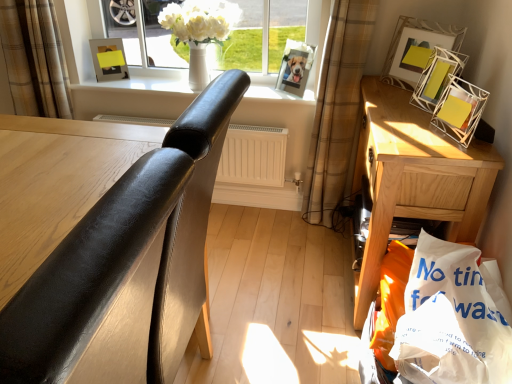
What is the approximate width of white smooth window sill at upper center?

white smooth window sill at upper center is 9.03 inches in width.

What do you see at coordinates (34, 58) in the screenshot? Image resolution: width=512 pixels, height=384 pixels. I see `plaid fabric curtain at upper left, which appears as the 1th curtain when viewed from the left` at bounding box center [34, 58].

Describe the element at coordinates (109, 59) in the screenshot. I see `yellow matte picture frame at upper left, acting as the 4th picture frame starting from the right` at that location.

At what (x,y) coordinates should I click in order to perform the action: click on white paper shopping bag at lower right. Please return your answer as a coordinate pair (x, y). The height and width of the screenshot is (384, 512). Looking at the image, I should click on (453, 318).

Is metallic silver picture frame at upper right, positioned as the second picture frame in right-to-left order, positioned far away from plaid fabric curtain at upper left, the second curtain in the right-to-left sequence?

Absolutely, metallic silver picture frame at upper right, positioned as the second picture frame in right-to-left order, is distant from plaid fabric curtain at upper left, the second curtain in the right-to-left sequence.

Can you confirm if metallic silver picture frame at upper right, positioned as the second picture frame in right-to-left order, is positioned to the left of plaid fabric curtain at upper left, which appears as the 1th curtain when viewed from the left?

No.

Is metallic silver picture frame at upper right, positioned as the second picture frame in right-to-left order, wider or thinner than plaid fabric curtain at upper left, which appears as the 1th curtain when viewed from the left?

Considering their sizes, metallic silver picture frame at upper right, positioned as the second picture frame in right-to-left order, looks slimmer than plaid fabric curtain at upper left, which appears as the 1th curtain when viewed from the left.

Is metallic silver picture frame at upper right, positioned as the second picture frame in right-to-left order, taller or shorter than plaid fabric curtain at upper left, the second curtain in the right-to-left sequence?

metallic silver picture frame at upper right, positioned as the second picture frame in right-to-left order, is shorter than plaid fabric curtain at upper left, the second curtain in the right-to-left sequence.

From a real-world perspective, between white wire mesh picture frame at upper right, acting as the first picture frame starting from the right, and plaid fabric curtain at upper left, which appears as the 1th curtain when viewed from the left, who is vertically higher?

In real-world perspective, white wire mesh picture frame at upper right, acting as the first picture frame starting from the right, is above.

Does point (422, 73) come farther from viewer compared to point (53, 45)?

No, (422, 73) is closer to viewer.

Which is more to the left, white wire mesh picture frame at upper right, acting as the first picture frame starting from the right, or plaid fabric curtain at upper left, which appears as the 1th curtain when viewed from the left?

plaid fabric curtain at upper left, which appears as the 1th curtain when viewed from the left.

Is white wire mesh picture frame at upper right, acting as the first picture frame starting from the right, behind plaid fabric curtain at upper left, the second curtain in the right-to-left sequence?

No.

Considering the relative sizes of black leather chair at left and white matte vase at upper center in the image provided, is black leather chair at left smaller than white matte vase at upper center?

Incorrect, black leather chair at left is not smaller in size than white matte vase at upper center.

Locate an element on the screen. The image size is (512, 384). floral arrangement that appears above the black leather chair at left (from a real-world perspective) is located at coordinates (199, 31).

Is point (51, 254) positioned in front of point (174, 9)?

Yes, it is.

From the picture: Considering the relative positions of black leather chair at left and white matte vase at upper center in the image provided, is black leather chair at left behind white matte vase at upper center?

No, black leather chair at left is closer to the viewer.

Is yellow matte picture frame at upper left, acting as the 4th picture frame starting from the right, not within white matte vase at upper center?

Yes, yellow matte picture frame at upper left, acting as the 4th picture frame starting from the right, is not within white matte vase at upper center.

From a real-world perspective, is yellow matte picture frame at upper left, acting as the 4th picture frame starting from the right, positioned above or below white matte vase at upper center?

In terms of real-world spatial position, yellow matte picture frame at upper left, acting as the 4th picture frame starting from the right, is below white matte vase at upper center.

Between yellow matte picture frame at upper left, the first picture frame positioned from the left, and white matte vase at upper center, which one has more height?

white matte vase at upper center.

From the image's perspective, which one is positioned higher, black leather chair at left or white wire mesh picture frame at upper right, positioned as the 4th picture frame in left-to-right order?

white wire mesh picture frame at upper right, positioned as the 4th picture frame in left-to-right order.

From a real-world perspective, is black leather chair at left positioned above or below white wire mesh picture frame at upper right, acting as the first picture frame starting from the right?

black leather chair at left is below white wire mesh picture frame at upper right, acting as the first picture frame starting from the right.

In terms of height, does black leather chair at left look taller or shorter compared to white wire mesh picture frame at upper right, acting as the first picture frame starting from the right?

Clearly, black leather chair at left is taller compared to white wire mesh picture frame at upper right, acting as the first picture frame starting from the right.

Which is correct: black leather chair at left is inside white wire mesh picture frame at upper right, positioned as the 4th picture frame in left-to-right order, or outside of it?

Result: black leather chair at left exists outside the volume of white wire mesh picture frame at upper right, positioned as the 4th picture frame in left-to-right order.

Which of these two, black leather chair at left or metallic silver picture frame at upper right, which is counted as the 3th picture frame, starting from the left, stands taller?

black leather chair at left is taller.

Which of these two, black leather chair at left or metallic silver picture frame at upper right, positioned as the second picture frame in right-to-left order, is wider?

With larger width is black leather chair at left.

From a real-world perspective, is black leather chair at left positioned above or below metallic silver picture frame at upper right, which is counted as the 3th picture frame, starting from the left?

In terms of real-world spatial position, black leather chair at left is below metallic silver picture frame at upper right, which is counted as the 3th picture frame, starting from the left.

From the image's perspective, is black leather chair at left located above or below metallic silver picture frame at upper right, positioned as the second picture frame in right-to-left order?

From the image's perspective, black leather chair at left appears below metallic silver picture frame at upper right, positioned as the second picture frame in right-to-left order.

Where is `window on the right of white smooth window sill at upper center`? Image resolution: width=512 pixels, height=384 pixels. window on the right of white smooth window sill at upper center is located at coordinates 79,35.

Is white smooth window sill at upper center next to white glossy vase at upper center and touching it?

No, white smooth window sill at upper center is not beside white glossy vase at upper center.

From the picture: From a real-world perspective, between white smooth window sill at upper center and white glossy vase at upper center, who is vertically lower?

From a 3D spatial view, white smooth window sill at upper center is below.

Is white smooth window sill at upper center closer to camera compared to white glossy vase at upper center?

No, it is not.

From the plaid fabric curtain at upper left, the second curtain in the right-to-left sequence, count 3rd picture frame to the right and point to it. Please provide its 2D coordinates.

[(415, 48)]

The height and width of the screenshot is (384, 512). In order to click on the 2nd picture frame directly above the plaid fabric curtain at upper left, the second curtain in the right-to-left sequence (from a real-world perspective) in this screenshot , I will do `click(436, 77)`.

Considering their positions, is plaid fabric curtain at upper left, the second curtain in the right-to-left sequence, positioned closer to yellow matte picture frame at upper left, the first picture frame positioned from the left, than white smooth window sill at upper center?

white smooth window sill at upper center lies closer to yellow matte picture frame at upper left, the first picture frame positioned from the left, than the other object.

Based on their spatial positions, is black leather chair at left or white smooth window sill at upper center further from plaid fabric curtain at center, placed as the 1th curtain when sorted from right to left?

black leather chair at left lies further to plaid fabric curtain at center, placed as the 1th curtain when sorted from right to left, than the other object.

Which object lies nearer to the anchor point plaid fabric curtain at upper left, the second curtain in the right-to-left sequence, yellow matte picture frame at upper left, acting as the 4th picture frame starting from the right, or white matte vase at upper center?

yellow matte picture frame at upper left, acting as the 4th picture frame starting from the right, is closer to plaid fabric curtain at upper left, the second curtain in the right-to-left sequence.

Considering their positions, is white matte vase at upper center positioned closer to plaid fabric curtain at upper left, which appears as the 1th curtain when viewed from the left, than black leather chair at left?

The object closer to plaid fabric curtain at upper left, which appears as the 1th curtain when viewed from the left, is white matte vase at upper center.

From the image, which object appears to be farther from white smooth window sill at upper center, white matte vase at upper center or metallic silver picture frame at upper right, positioned as the second picture frame in right-to-left order?

metallic silver picture frame at upper right, positioned as the second picture frame in right-to-left order, is positioned further to the anchor white smooth window sill at upper center.

When comparing their distances from white smooth window sill at upper center, does white paper shopping bag at lower right or plaid fabric curtain at upper left, which appears as the 1th curtain when viewed from the left, seem further?

white paper shopping bag at lower right is positioned further to the anchor white smooth window sill at upper center.

Looking at the image, which one is located further to plaid fabric curtain at upper left, which appears as the 1th curtain when viewed from the left, metallic silver photo frame at upper center, the 3th picture frame viewed from the right, or yellow matte picture frame at upper left, the first picture frame positioned from the left?

Based on the image, metallic silver photo frame at upper center, the 3th picture frame viewed from the right, appears to be further to plaid fabric curtain at upper left, which appears as the 1th curtain when viewed from the left.

From the image, which object appears to be farther from white smooth window sill at upper center, wooden nightstand at right or white matte vase at upper center?

The object further to white smooth window sill at upper center is wooden nightstand at right.

The height and width of the screenshot is (384, 512). Find the location of `picture frame that lies between metallic silver picture frame at upper right, positioned as the second picture frame in right-to-left order, and wooden nightstand at right from top to bottom`. picture frame that lies between metallic silver picture frame at upper right, positioned as the second picture frame in right-to-left order, and wooden nightstand at right from top to bottom is located at coordinates (436, 77).

Where is `floral arrangement located between black leather chair at left and white matte radiator at center in the depth direction`? floral arrangement located between black leather chair at left and white matte radiator at center in the depth direction is located at coordinates (199, 31).

Find the location of a particular element. This screenshot has width=512, height=384. shopping bag between black leather chair at left and metallic silver photo frame at upper center, which is counted as the 2th picture frame, starting from the left, along the z-axis is located at coordinates [453, 318].

At what (x,y) coordinates should I click in order to perform the action: click on picture frame between yellow matte picture frame at upper left, the first picture frame positioned from the left, and plaid fabric curtain at center, the second curtain when ordered from left to right. Please return your answer as a coordinate pair (x, y). The image size is (512, 384). Looking at the image, I should click on (295, 67).